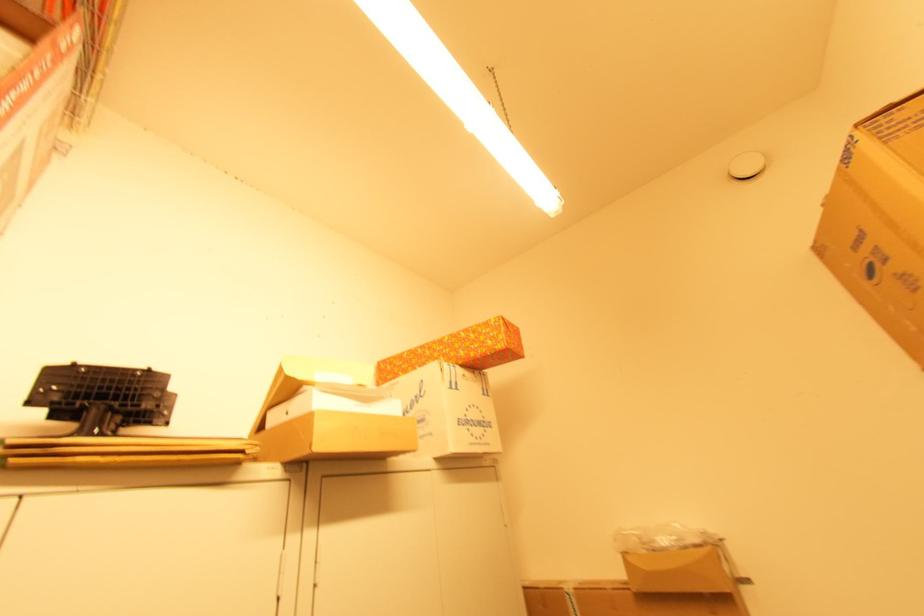
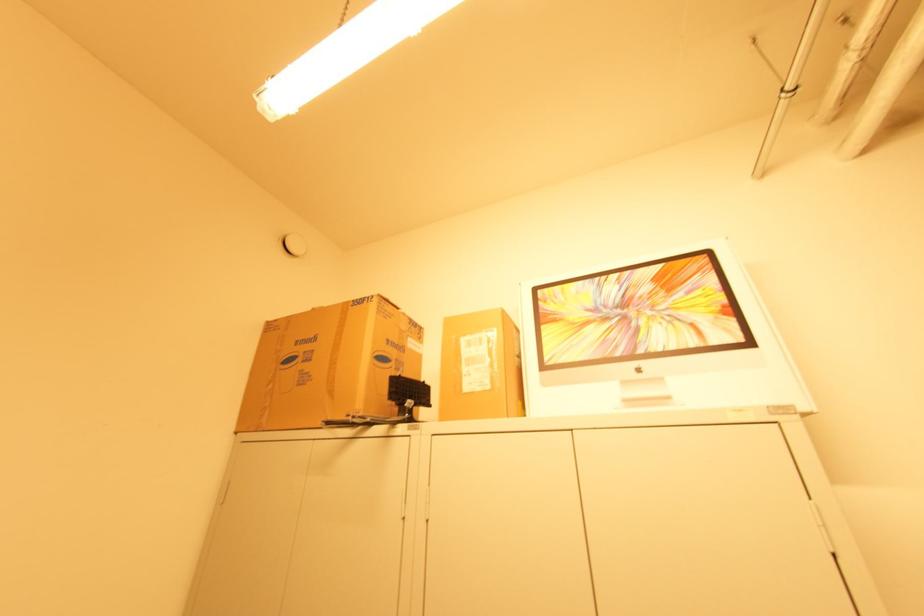
In the second image, find the point that corresponds to (825,206) in the first image.

(315, 309)